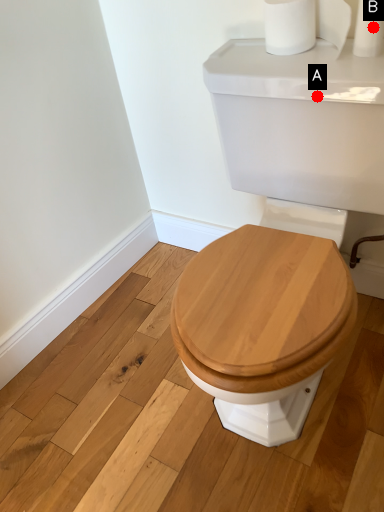
Question: Two points are circled on the image, labeled by A and B beside each circle. Which point is farther from the camera taking this photo?

Choices:
 (A) A is further
 (B) B is further

Answer: (B)